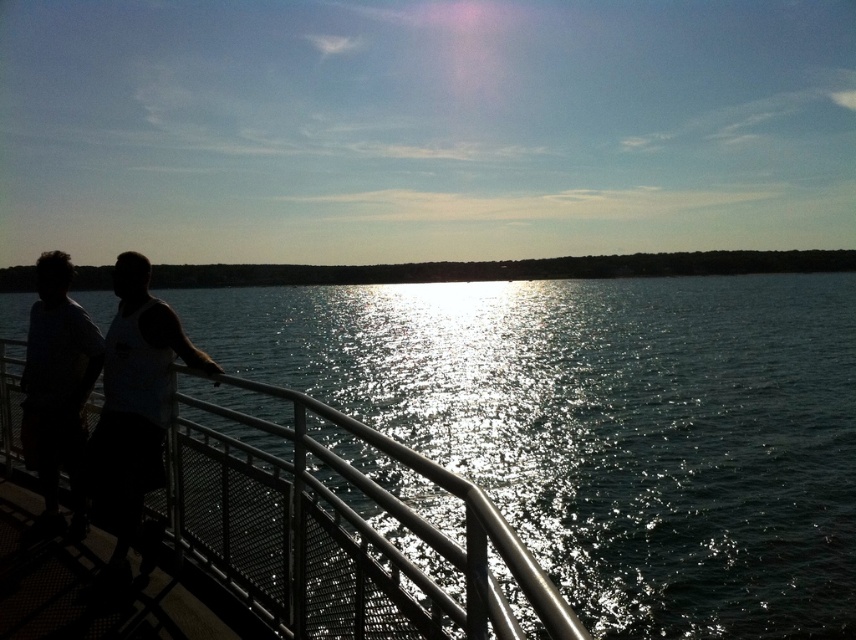
You are a photographer trying to capture the sunset reflection on the water. You notice the metallic silver rail at center and the black matte tank top at center in your frame. Which object should you adjust your focus on if you want to ensure the larger one is in sharp detail?

The metallic silver rail at center is larger in size than the black matte tank top at center, so you should focus on the metallic silver rail at center to ensure the larger object is in sharp detail.

You are a photographer trying to capture both the black matte tank top at center and the matte white shirt at left in a single shot. Since you want to ensure both are visible, which clothing item should you focus on first to get the best depth of field?

The black matte tank top at center is in front of the matte white shirt at left. To ensure both are in focus, you should focus on the matte white shirt at left because it is farther away, allowing the depth of field to cover both subjects.

You are a photographer trying to capture the sunset reflection on the water. You notice the metallic silver rail at center and the matte white shirt at left in your frame. Which object should you adjust your focus on if you want to ensure the larger object is sharp?

The metallic silver rail at center is larger than the matte white shirt at left, so you should focus on the metallic silver rail at center to ensure the larger object is sharp.